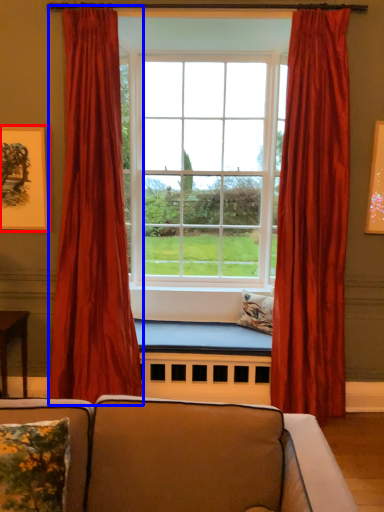
Question: Which object appears farthest to the camera in this image, picture frame (highlighted by a red box) or curtain (highlighted by a blue box)?

Choices:
 (A) picture frame
 (B) curtain

Answer: (A)